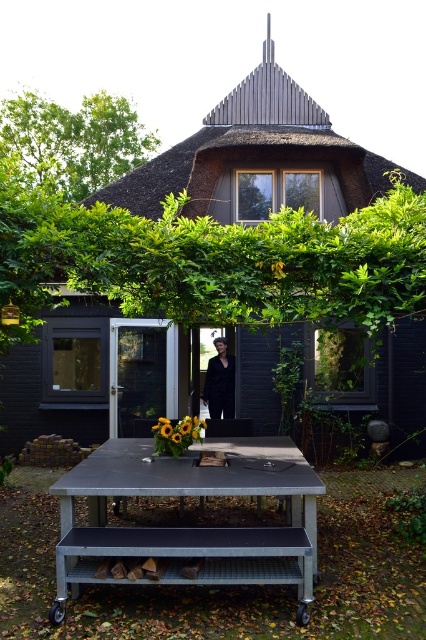
You are standing in front of the house and see the black wood hut at center and the black fabric at center. Which object is positioned higher relative to the other?

The black wood hut at center is located above the black fabric at center, so it is positioned higher.

You are planning to set up a small garden table for two people in the front yard of the black wood hut at center. Given that the metallic gray table at center is already there, can the new table fit without overlapping the existing one?

The black wood hut at center is bigger than the metallic gray table at center, but the size comparison between the two objects does not provide information about available space for another table. You need to consider the overall layout and ensure there is enough room in the front yard besides the existing table.

You are standing at a certain distance from the black wood hut at center and want to throw a ball to hit the thatched roof. If the ball can travel 10 meters, will it reach the roof?

The distance between the black wood hut at center and the viewer is 8.73 meters. Since the ball can travel 10 meters, which is farther than 8.73 meters, the ball will reach the roof.